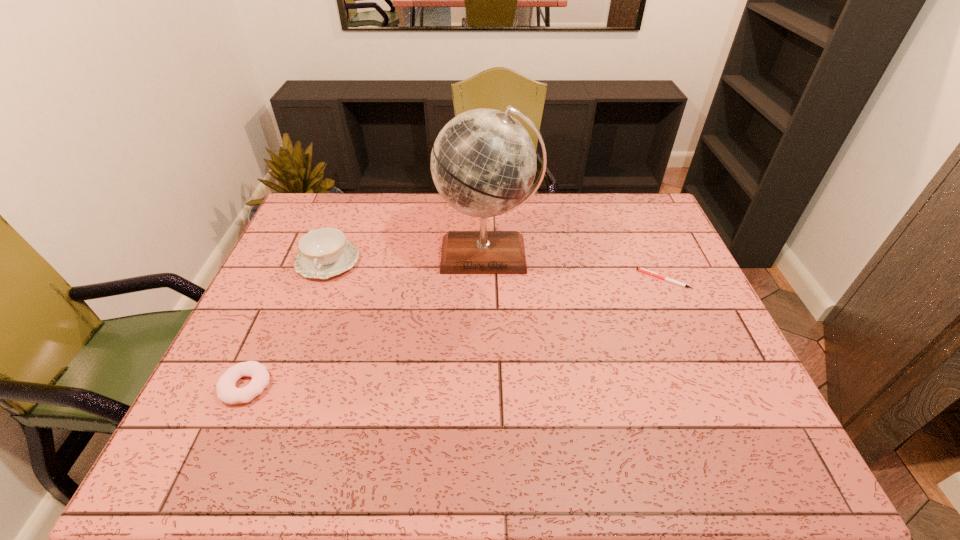
Image resolution: width=960 pixels, height=540 pixels. I want to click on vacant point located on the clicker of the shortest object, so click(x=552, y=279).

This screenshot has height=540, width=960. I want to click on free location located on the clicker of the shortest object, so click(x=622, y=279).

The image size is (960, 540). Identify the location of vacant area situated 0.210m on the clicker of the shortest object. (568, 279).

Locate an element on the screen. The width and height of the screenshot is (960, 540). object at the far edge is located at coordinates (483, 163).

Find the location of a particular element. The width and height of the screenshot is (960, 540). chinaware at the left edge is located at coordinates (324, 252).

What are the coordinates of `doughnut positioned at the left edge` in the screenshot? It's located at (227, 392).

I want to click on object that is at the right edge, so click(x=639, y=269).

Find the location of `free region at the far edge`. free region at the far edge is located at coordinates (397, 231).

At what (x,y) coordinates should I click in order to perform the action: click on free region at the left edge of the desktop. Please return your answer as a coordinate pair (x, y). This screenshot has height=540, width=960. Looking at the image, I should click on pyautogui.click(x=222, y=375).

I want to click on vacant space at the right edge of the desktop, so click(652, 239).